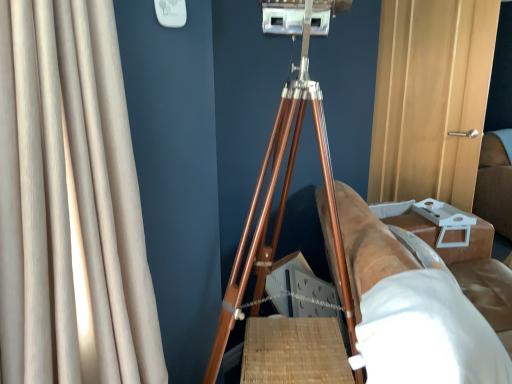
What do you see at coordinates (494, 185) in the screenshot? I see `brown leather couch at right` at bounding box center [494, 185].

The height and width of the screenshot is (384, 512). What do you see at coordinates (285, 177) in the screenshot?
I see `wooden tripod at center` at bounding box center [285, 177].

Measure the distance between point (457, 324) and camera.

They are 96.10 centimeters apart.

Based on the photo, what is the approximate width of beige fabric curtain at left?

It is 34.18 centimeters.

In order to click on brown leather couch at right in this screenshot , I will do point(494,185).

From the image's perspective, which one is positioned lower, white matte sheet at lower right or brown leather couch at right?

brown leather couch at right.

Considering the relative sizes of white matte sheet at lower right and brown leather couch at right in the image provided, is white matte sheet at lower right shorter than brown leather couch at right?

Correct, white matte sheet at lower right is not as tall as brown leather couch at right.

Locate an element on the screen. This screenshot has height=384, width=512. sheet that is above the brown leather couch at right (from the image's perspective) is located at coordinates (426, 333).

Based on their sizes in the image, would you say beige fabric curtain at left is bigger or smaller than white matte sheet at lower right?

In the image, beige fabric curtain at left appears to be larger than white matte sheet at lower right.

Who is more distant, beige fabric curtain at left or white matte sheet at lower right?

Positioned behind is white matte sheet at lower right.

In terms of width, does beige fabric curtain at left look wider or thinner when compared to white matte sheet at lower right?

Considering their sizes, beige fabric curtain at left looks slimmer than white matte sheet at lower right.

Is point (483, 140) positioned behind point (309, 24)?

Yes, point (483, 140) is behind point (309, 24).

Image resolution: width=512 pixels, height=384 pixels. What are the coordinates of `tripod above the brown leather couch at right (from a real-world perspective)` in the screenshot? It's located at (285, 177).

How far apart are brown leather couch at right and wooden tripod at center?

brown leather couch at right and wooden tripod at center are 2.53 meters apart.

In the scene shown: What's the angular difference between brown leather couch at right and wooden tripod at center's facing directions?

The angular difference between brown leather couch at right and wooden tripod at center is 80.3 degrees.

Considering the positions of point (431, 284) and point (488, 204), is point (431, 284) closer or farther from the camera than point (488, 204)?

Point (431, 284) appears to be closer to the viewer than point (488, 204).

Would you say brown leather couch at right is a long distance from brown leather couch at right?

brown leather couch at right is positioned a significant distance from brown leather couch at right.

Is brown leather couch at right to the right of brown leather couch at right from the viewer's perspective?

No.

Considering the relative positions of brown leather couch at right and beige fabric curtain at left in the image provided, is brown leather couch at right to the left of beige fabric curtain at left from the viewer's perspective?

Incorrect, brown leather couch at right is not on the left side of beige fabric curtain at left.

Considering the relative sizes of brown leather couch at right and beige fabric curtain at left in the image provided, is brown leather couch at right thinner than beige fabric curtain at left?

No.

Are brown leather couch at right and beige fabric curtain at left making contact?

brown leather couch at right and beige fabric curtain at left are not in contact.

Image resolution: width=512 pixels, height=384 pixels. What are the coordinates of `sheet located underneath the beige fabric curtain at left (from a real-world perspective)` in the screenshot? It's located at (426, 333).

How many degrees apart are the facing directions of white matte sheet at lower right and beige fabric curtain at left?

37 degrees separate the facing orientations of white matte sheet at lower right and beige fabric curtain at left.

Considering the relative sizes of white matte sheet at lower right and beige fabric curtain at left in the image provided, is white matte sheet at lower right thinner than beige fabric curtain at left?

Incorrect, the width of white matte sheet at lower right is not less than that of beige fabric curtain at left.

Is point (37, 216) positioned in front of point (502, 176)?

Yes, it is.

Looking at this image, is beige fabric curtain at left shorter than brown leather couch at right?

No, beige fabric curtain at left is not shorter than brown leather couch at right.

Looking at this image, would you say beige fabric curtain at left is inside or outside brown leather couch at right?

beige fabric curtain at left is not inside brown leather couch at right, it's outside.

Would you say beige fabric curtain at left is a long distance from brown leather couch at right?

Yes, beige fabric curtain at left and brown leather couch at right are located far from each other.

Where is `furniture below the white matte sheet at lower right (from a real-world perspective)`? This screenshot has width=512, height=384. furniture below the white matte sheet at lower right (from a real-world perspective) is located at coordinates (411, 310).

You are a GUI agent. You are given a task and a screenshot of the screen. Output one action in this format:
    pyautogui.click(x=<x>, y=<y>)
    Task: Click on the curtain above the white matte sheet at lower right (from the image's perspective)
    The image size is (512, 384).
    Given the screenshot: What is the action you would take?
    tap(70, 204)

Which object lies further to the anchor point brown leather couch at right, brown leather couch at right or wooden tripod at center?

brown leather couch at right.

Looking at the image, which one is located closer to wooden tripod at center, brown leather couch at right or brown leather couch at right?

brown leather couch at right is positioned closer to the anchor wooden tripod at center.

Estimate the real-world distances between objects in this image. Which object is closer to wooden tripod at center, brown leather couch at right or beige fabric curtain at left?

brown leather couch at right lies closer to wooden tripod at center than the other object.

Considering their positions, is brown leather couch at right positioned closer to white matte sheet at lower right than beige fabric curtain at left?

brown leather couch at right.

Looking at this image, which object lies nearer to the anchor point brown leather couch at right, brown leather couch at right or wooden tripod at center?

brown leather couch at right lies closer to brown leather couch at right than the other object.

When comparing their distances from brown leather couch at right, does beige fabric curtain at left or brown leather couch at right seem closer?

The object closer to brown leather couch at right is brown leather couch at right.

Based on their spatial positions, is beige fabric curtain at left or brown leather couch at right closer to brown leather couch at right?

Among the two, beige fabric curtain at left is located nearer to brown leather couch at right.

Looking at the image, which one is located closer to brown leather couch at right, wooden tripod at center or brown leather couch at right?

wooden tripod at center lies closer to brown leather couch at right than the other object.

Where is `tripod between beige fabric curtain at left and brown leather couch at right from left to right`? This screenshot has height=384, width=512. tripod between beige fabric curtain at left and brown leather couch at right from left to right is located at coordinates (285, 177).

Image resolution: width=512 pixels, height=384 pixels. What are the coordinates of `tripod positioned between white matte sheet at lower right and brown leather couch at right from near to far` in the screenshot? It's located at (285, 177).

Identify the location of tripod between beige fabric curtain at left and white matte sheet at lower right. This screenshot has width=512, height=384. (285, 177).

Locate an element on the screen. The width and height of the screenshot is (512, 384). sheet between wooden tripod at center and brown leather couch at right is located at coordinates (426, 333).